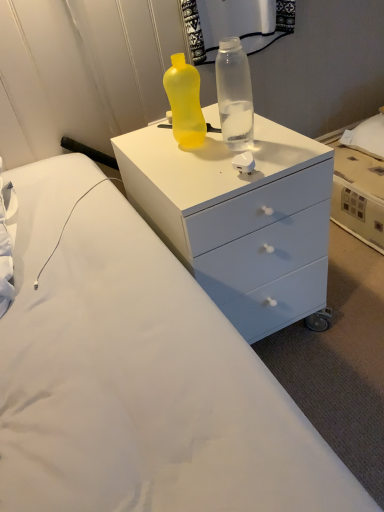
Where is `vacant space situated above white matte chest of drawers at center (from a real-world perspective)`? The width and height of the screenshot is (384, 512). vacant space situated above white matte chest of drawers at center (from a real-world perspective) is located at coordinates (195, 139).